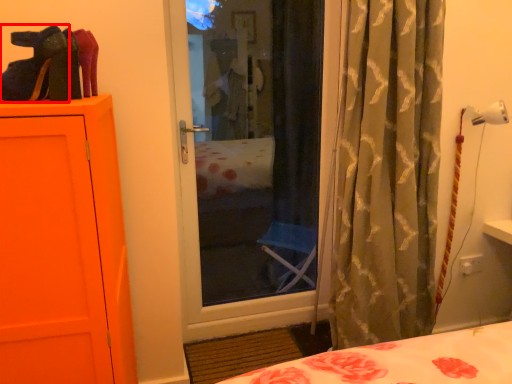
Question: From the image's perspective, what is the correct spatial relationship of shoe (annotated by the red box) in relation to curtain?

Choices:
 (A) below
 (B) above

Answer: (B)